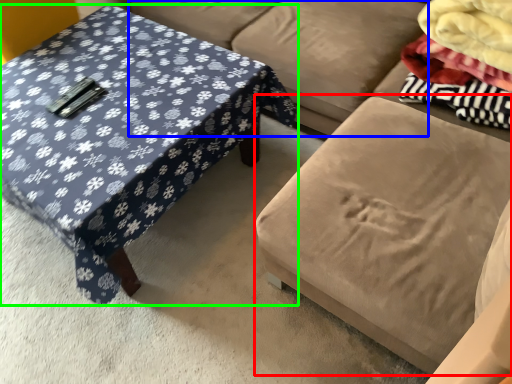
Question: Which object is the closest to the swivel chair (highlighted by a red box)? Choose among these: couch (highlighted by a blue box) or coffee table (highlighted by a green box).

Choices:
 (A) couch
 (B) coffee table

Answer: (A)